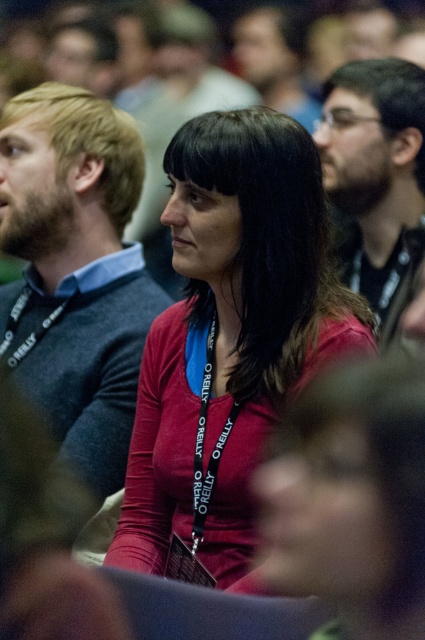
You are a photographer at the conference. You want to take a photo of the attendee wearing the matte gray sweater at left and the matte black glasses at upper right. Can you ensure both are fully visible in the same frame without any obstruction?

The matte gray sweater at left is in front of the matte black glasses at upper right, so the sweater may block the glasses in the photo. Adjust your angle to capture both without obstruction.